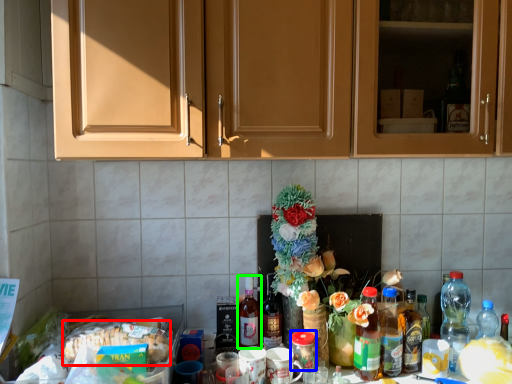
Question: Which object is the farthest from food (highlighted by a red box)? Choose among these: beverage (highlighted by a blue box) or bottle (highlighted by a green box).

Choices:
 (A) beverage
 (B) bottle

Answer: (A)